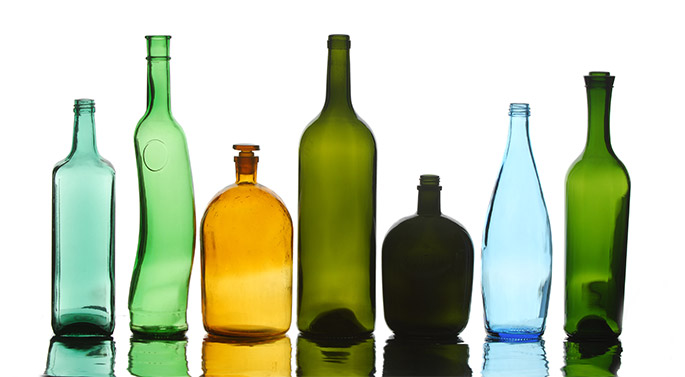
You are a GUI agent. You are given a task and a screenshot of the screen. Output one action in this format:
    pyautogui.click(x=<x>, y=<y>)
    Task: Click on the bottles
    
    Given the screenshot: What is the action you would take?
    (x=62, y=237), (x=182, y=193), (x=251, y=285), (x=321, y=199), (x=425, y=262), (x=534, y=262), (x=601, y=250)